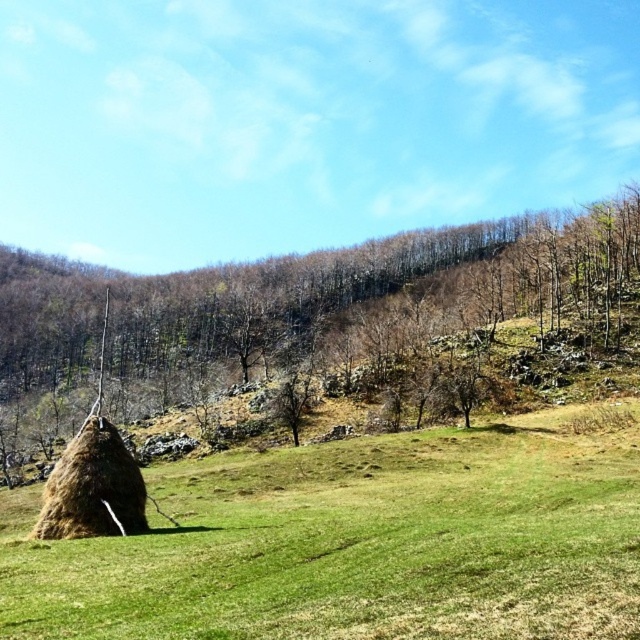
Question: Which point is closer to the camera?

Choices:
 (A) brown textured hay at lower left
 (B) green grassy field at lower left

Answer: (B)

Question: Which object appears farthest from the camera in this image?

Choices:
 (A) green grassy field at lower left
 (B) brown textured hay at lower left

Answer: (B)

Question: From the image, what is the correct spatial relationship of green grassy field at lower left in relation to brown textured hay at lower left?

Choices:
 (A) below
 (B) above

Answer: (A)

Question: Considering the relative positions of green grassy field at lower left and brown textured hay at lower left in the image provided, where is green grassy field at lower left located with respect to brown textured hay at lower left?

Choices:
 (A) below
 (B) above

Answer: (A)

Question: Is green grassy field at lower left closer to the viewer compared to brown textured hay at lower left?

Choices:
 (A) yes
 (B) no

Answer: (A)